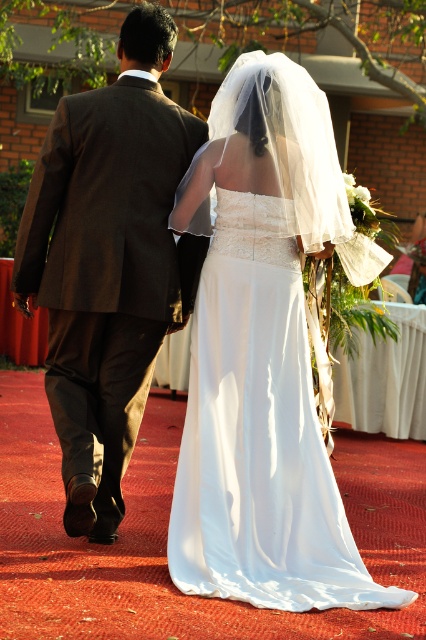
Question: Which of the following is the closest to the observer?

Choices:
 (A) (344, 516)
 (B) (161, 38)

Answer: (A)

Question: Can you confirm if brown wool suit at left is wider than white satin dress at center?

Choices:
 (A) no
 (B) yes

Answer: (A)

Question: Is brown wool suit at left bigger than white satin dress at center?

Choices:
 (A) yes
 (B) no

Answer: (A)

Question: Among these objects, which one is farthest from the camera?

Choices:
 (A) white satin dress at center
 (B) brown wool suit at left

Answer: (B)

Question: Does brown wool suit at left appear on the left side of white satin dress at center?

Choices:
 (A) no
 (B) yes

Answer: (B)